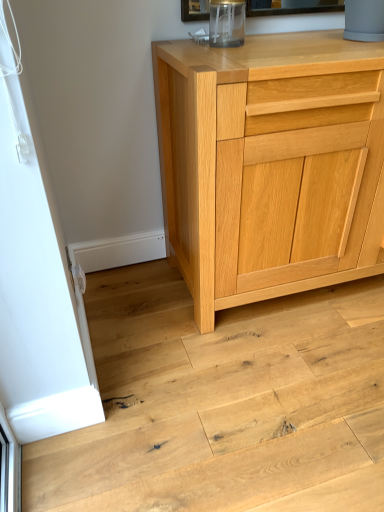
Question: In terms of width, does natural wood floor at lower left look wider or thinner when compared to natural wood cabinet at center?

Choices:
 (A) wide
 (B) thin

Answer: (A)

Question: Based on their positions, is natural wood floor at lower left located to the left or right of natural wood cabinet at center?

Choices:
 (A) right
 (B) left

Answer: (B)

Question: From their relative heights in the image, would you say natural wood floor at lower left is taller or shorter than natural wood cabinet at center?

Choices:
 (A) short
 (B) tall

Answer: (A)

Question: Is natural wood cabinet at center taller or shorter than natural wood floor at lower left?

Choices:
 (A) short
 (B) tall

Answer: (B)

Question: From the image's perspective, is natural wood cabinet at center positioned above or below natural wood floor at lower left?

Choices:
 (A) below
 (B) above

Answer: (B)

Question: Looking at the image, does natural wood cabinet at center seem bigger or smaller compared to natural wood floor at lower left?

Choices:
 (A) big
 (B) small

Answer: (A)

Question: Do you think natural wood cabinet at center is within natural wood floor at lower left, or outside of it?

Choices:
 (A) outside
 (B) inside

Answer: (A)